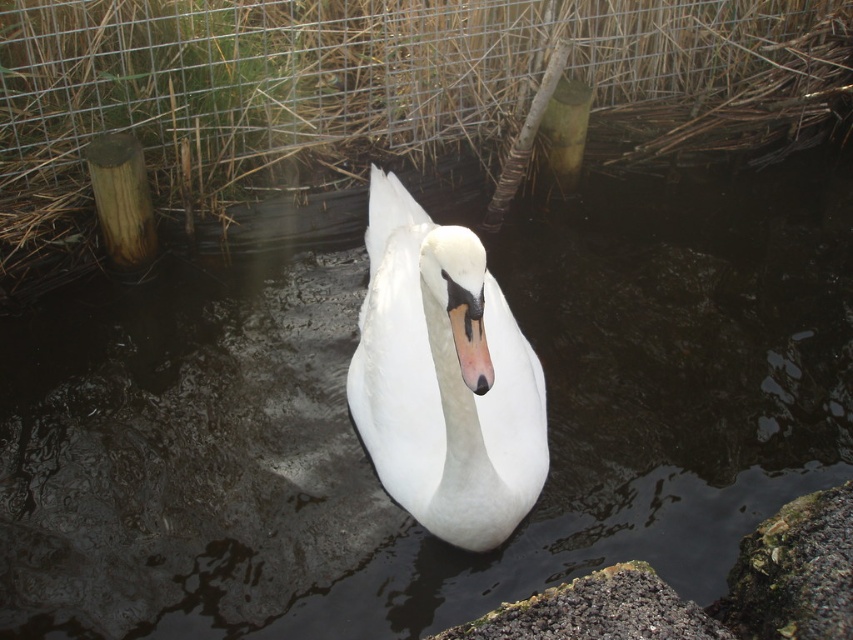
You are a photographer aiming to capture the white glossy swan at center and the gray gravelly rock at lower center in the same frame. Based on their positions, which object should you adjust your camera to focus on first if you want to include both in your shot?

The white glossy swan at center is to the left of the gray gravelly rock at lower center, so you should focus on the gray gravelly rock at lower center first to ensure both are in frame.